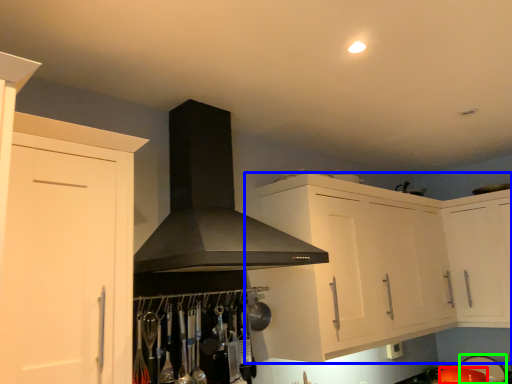
Question: Which object is positioned closest to appliance (highlighted by a red box)? Select from cabinetry (highlighted by a blue box) and appliance (highlighted by a green box).

Choices:
 (A) cabinetry
 (B) appliance

Answer: (B)